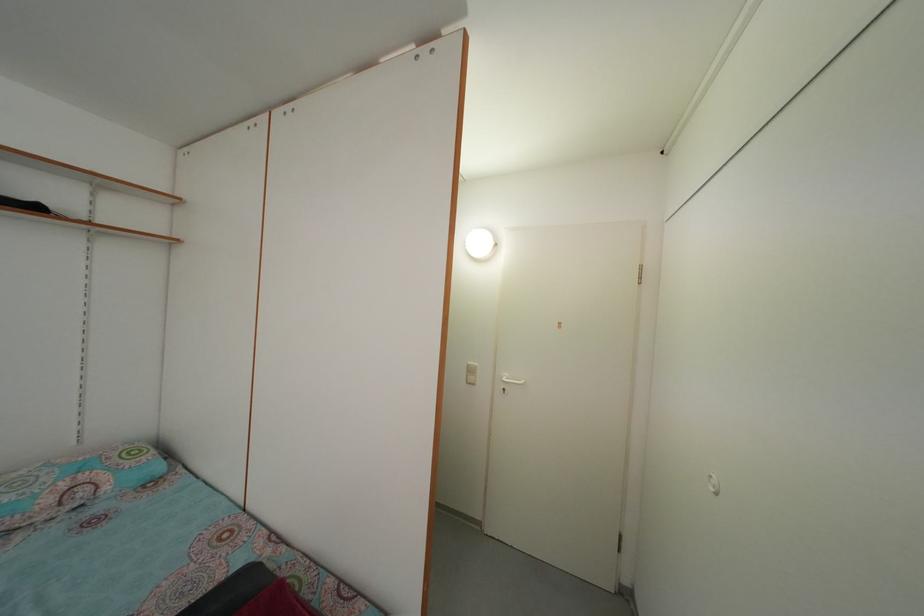
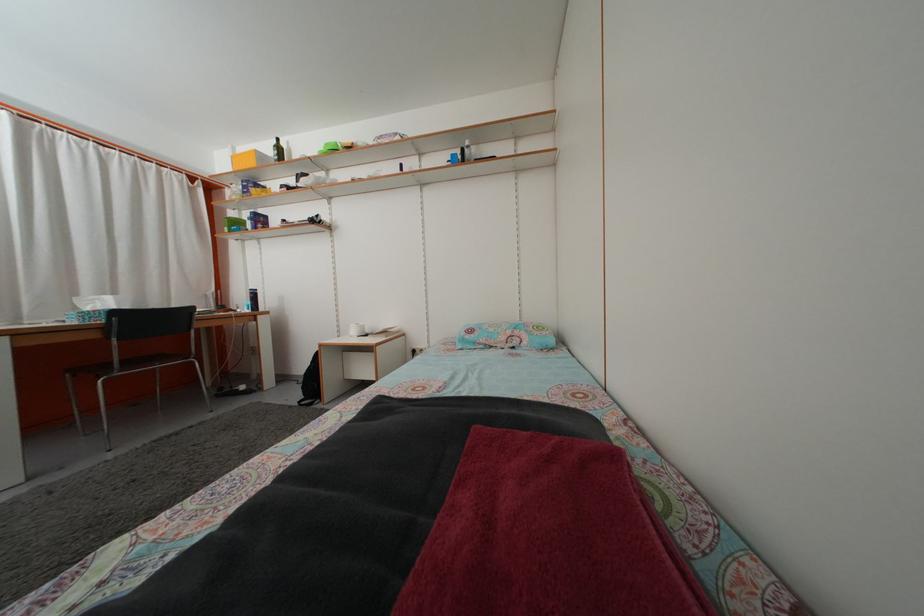
Question: Based on the continuous images, in which direction is the camera rotating? Reply with the corresponding letter.

Choices:
 (A) Left
 (B) Right
 (C) Up
 (D) Down

Answer: (A)